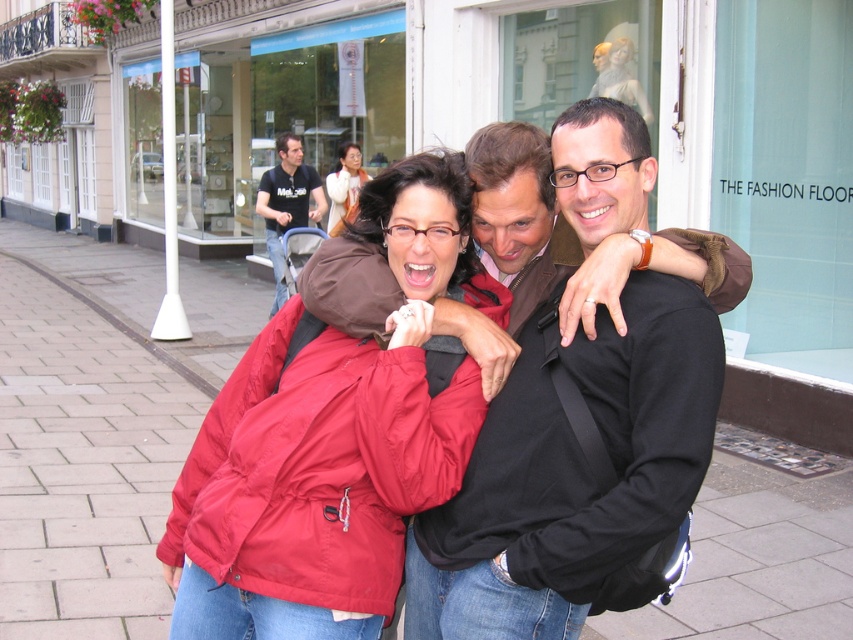
Question: Where is paved stone sidewalk at center located in relation to black cotton shirt at upper left in the image?

Choices:
 (A) left
 (B) right

Answer: (A)

Question: Considering the real-world distances, which object is closest to the paved stone sidewalk at center?

Choices:
 (A) matte black jacket at center
 (B) matte brown coat at center

Answer: (B)

Question: Does matte black jacket at center appear on the right side of black cotton shirt at upper left?

Choices:
 (A) no
 (B) yes

Answer: (B)

Question: Which of these objects is positioned farthest from the black cotton shirt at upper left?

Choices:
 (A) matte black jacket at center
 (B) matte brown coat at center

Answer: (A)

Question: Which of these objects is positioned closest to the matte black jacket at center?

Choices:
 (A) matte brown coat at center
 (B) black cotton shirt at upper left

Answer: (B)

Question: Can you confirm if paved stone sidewalk at center is thinner than matte brown coat at center?

Choices:
 (A) no
 (B) yes

Answer: (A)